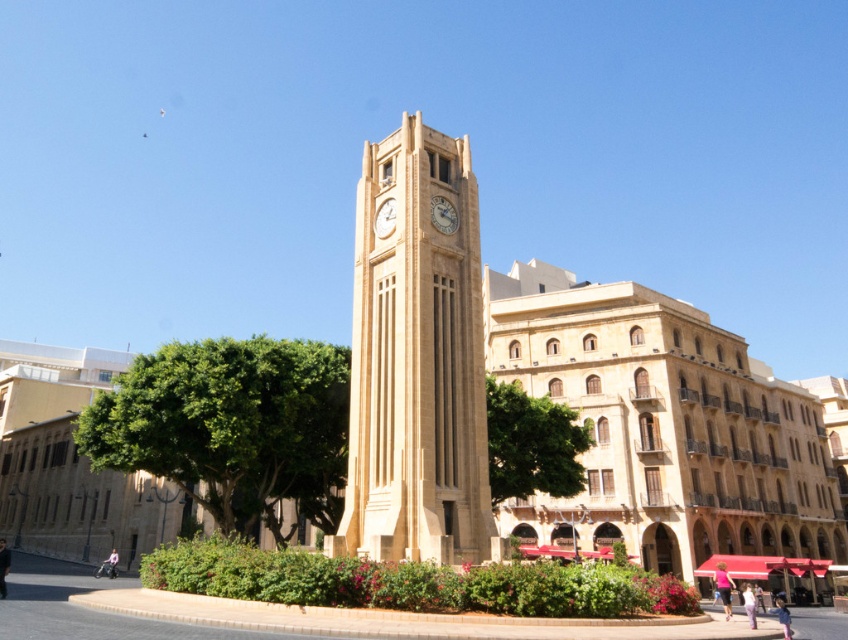
Does green leafy tree at center lie in front of golden textured clock at center?

Yes, green leafy tree at center is in front of golden textured clock at center.

Does green leafy tree at center appear under golden textured clock at center?

Indeed, green leafy tree at center is positioned under golden textured clock at center.

This screenshot has width=848, height=640. I want to click on green leafy tree at center, so click(x=533, y=444).

Is green leafy tree at lower left bigger than golden stone clock at center?

Indeed, green leafy tree at lower left has a larger size compared to golden stone clock at center.

Which is behind, point (279, 388) or point (431, 216)?

The point (279, 388) is more distant.

Who is more distant from viewer, (121, 378) or (452, 221)?

The point (121, 378) is behind.

The width and height of the screenshot is (848, 640). Find the location of `green leafy tree at lower left`. green leafy tree at lower left is located at coordinates 232,426.

Which is behind, point (422, 547) or point (492, 483)?

The point (492, 483) is more distant.

Identify the location of beige stone clock tower at center. (416, 362).

Locate an element on the screen. This screenshot has height=640, width=848. beige stone clock tower at center is located at coordinates tap(416, 362).